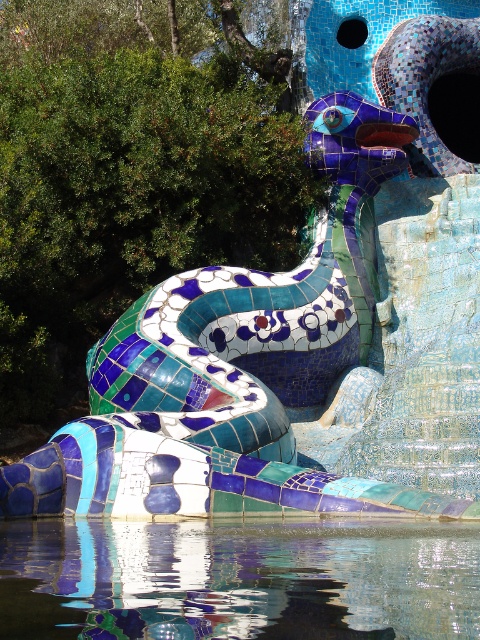
You are an artist standing at the center of the park. You want to draw the mosaic tile snake at center. Which direction should you face to ensure the sculpture is directly in front of you?

Since the 2D location of the mosaic tile snake at center is at point (236, 369), you should face towards the northeast direction to have the sculpture directly in front of you.

You are an artist planning to paint a mural inspired by the sculpture. You want to ensure the mosaic tile snake at center and transparent glass water at lower center maintain their original spatial relationship. Which object should be placed to the right of the other?

The mosaic tile snake at center should be placed to the right of transparent glass water at lower center to maintain their original spatial relationship.

You are a visitor at the park and want to take a photo of the transparent glass water at lower center without the mosaic tile snake at center blocking the view. Is there a way to position yourself to achieve this?

The mosaic tile snake at center is above the transparent glass water at lower center, so you can position yourself lower to avoid the snake blocking the view of the water.